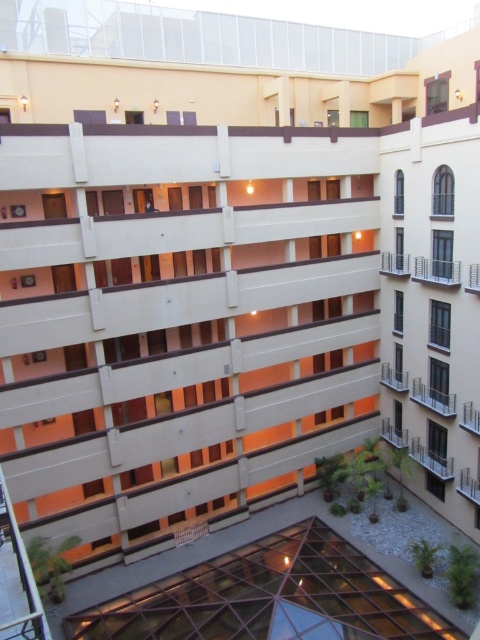
Question: Can you confirm if transparent glass atrium at lower center is thinner than matte white balcony at center-right?

Choices:
 (A) no
 (B) yes

Answer: (A)

Question: Does transparent glass atrium at lower center appear over matte white balcony at center-right?

Choices:
 (A) no
 (B) yes

Answer: (A)

Question: Can you confirm if transparent glass atrium at lower center is smaller than matte white balcony at center-right?

Choices:
 (A) yes
 (B) no

Answer: (B)

Question: Which object appears closest to the camera in this image?

Choices:
 (A) transparent glass atrium at lower center
 (B) matte white balcony at center-right

Answer: (A)